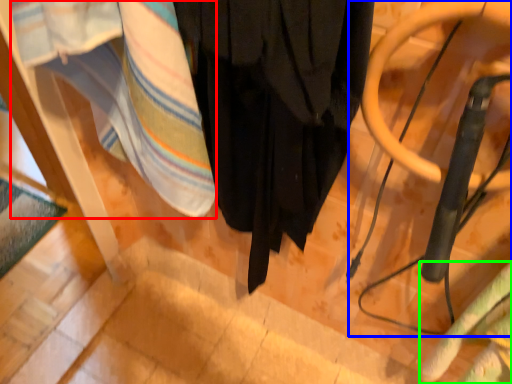
Question: Considering the real-world distances, which object is farthest from blanket (highlighted by a red box)? swivel chair (highlighted by a blue box) or blanket (highlighted by a green box)?

Choices:
 (A) swivel chair
 (B) blanket

Answer: (B)